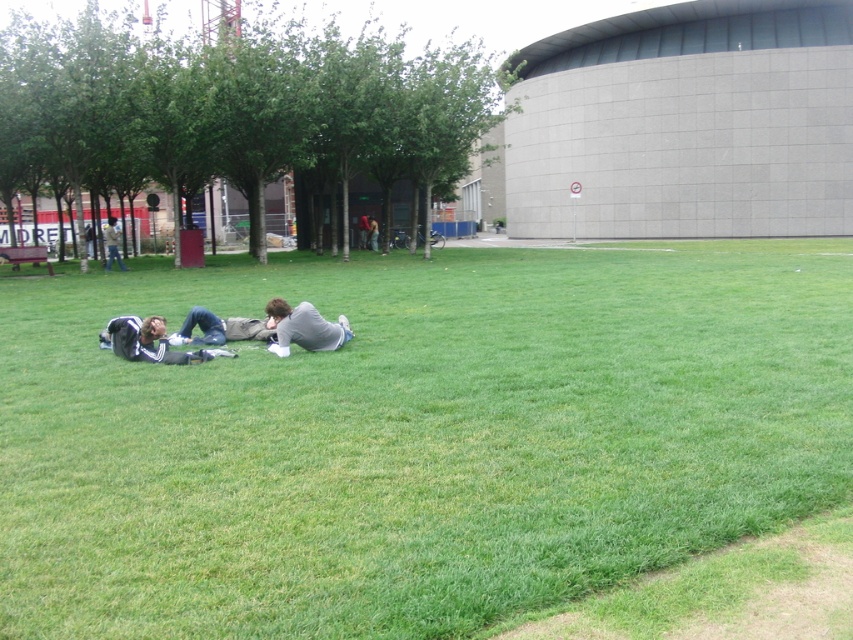
Who is taller, dark gray fabric jacket at lower left or gray fabric jacket at center?

With more height is gray fabric jacket at center.

Locate an element on the screen. Image resolution: width=853 pixels, height=640 pixels. dark gray fabric jacket at lower left is located at coordinates (146, 340).

In order to click on dark gray fabric jacket at lower left in this screenshot , I will do `click(146, 340)`.

Does green grass at lower left have a greater height compared to gray fabric jacket at center?

No, green grass at lower left is not taller than gray fabric jacket at center.

Is point (552, 593) less distant than point (108, 227)?

Yes, point (552, 593) is closer to viewer.

Which is in front, point (241, 451) or point (109, 234)?

Point (241, 451)

What are the coordinates of `green grass at lower left` in the screenshot? It's located at (413, 435).

Does green grass at lower left appear on the right side of dark gray fabric jacket at lower left?

Indeed, green grass at lower left is positioned on the right side of dark gray fabric jacket at lower left.

Between point (349, 605) and point (131, 353), which one is positioned behind?

The point (131, 353) is behind.

The height and width of the screenshot is (640, 853). What do you see at coordinates (413, 435) in the screenshot? I see `green grass at lower left` at bounding box center [413, 435].

Identify the location of green grass at lower left. (413, 435).